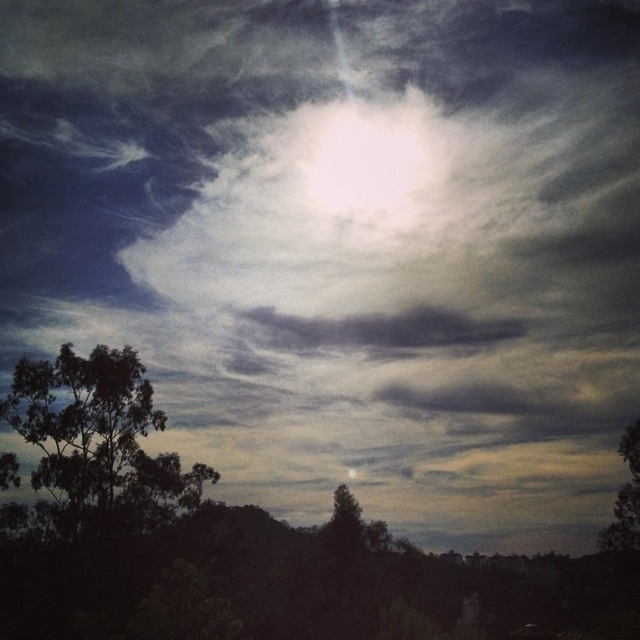
Question: Does dark green leafy tree at left appear on the right side of dark gray cloud at center?

Choices:
 (A) no
 (B) yes

Answer: (A)

Question: Is dark green leafy tree at left bigger than dark gray cloud at center?

Choices:
 (A) yes
 (B) no

Answer: (A)

Question: Which object is farther from the camera taking this photo?

Choices:
 (A) dark gray cloud at center
 (B) green leafy tree at lower right
 (C) dark green leafy tree at left

Answer: (A)

Question: Considering the real-world distances, which object is farthest from the green leafy tree at lower right?

Choices:
 (A) dark green leafy tree at left
 (B) dark gray cloud at center

Answer: (A)

Question: Is dark gray cloud at center behind green leafy tree at lower right?

Choices:
 (A) no
 (B) yes

Answer: (B)

Question: Which of the following is the closest to the observer?

Choices:
 (A) dark gray cloud at center
 (B) dark green leafy tree at left

Answer: (B)